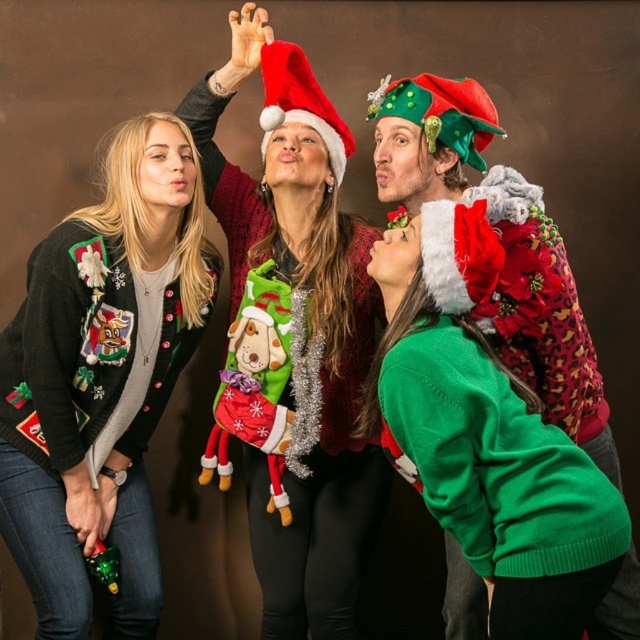
From the picture: You are standing 2 meters away from the point at coordinates point (x=346, y=579). Can you reach it without moving closer?

The point (x=346, y=579) is 2.10 meters away from the viewer. Since you are standing 2 meters away, you are still 0.10 meters too far to reach it without moving closer.